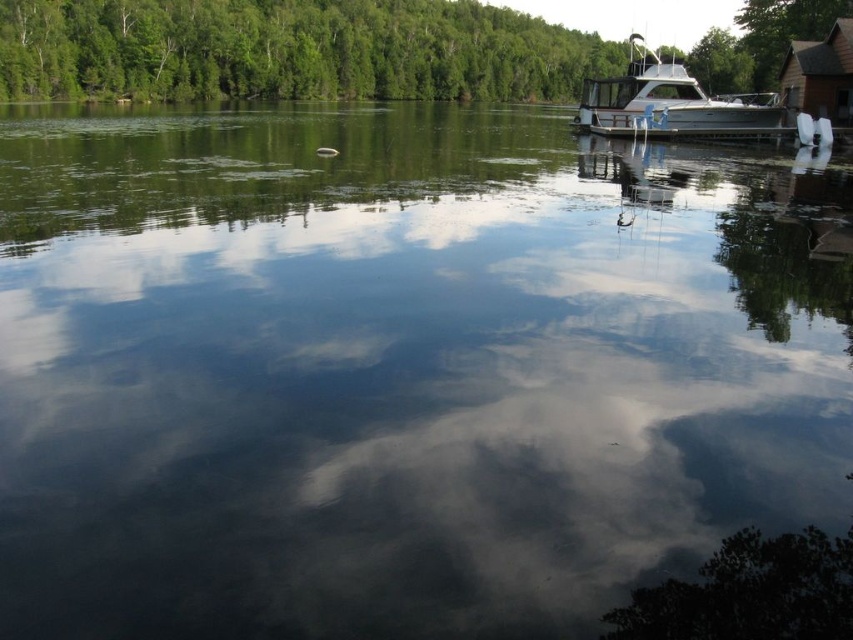
Question: Which point appears farthest from the camera in this image?

Choices:
 (A) (514, 88)
 (B) (804, 97)

Answer: (A)

Question: Which object is farther from the camera taking this photo?

Choices:
 (A) brown wooden cabin at upper right
 (B) green leafy tree at upper center

Answer: (B)

Question: Is green leafy tree at upper center thinner than silver metallic boat at upper right?

Choices:
 (A) yes
 (B) no

Answer: (B)

Question: Which of the following is the farthest from the observer?

Choices:
 (A) (706, 56)
 (B) (596, 90)
 (C) (796, 60)

Answer: (A)

Question: Is silver metallic boat at upper right above brown wooden cabin at upper right?

Choices:
 (A) yes
 (B) no

Answer: (A)

Question: Does silver metallic boat at upper right come behind brown wooden cabin at upper right?

Choices:
 (A) yes
 (B) no

Answer: (A)